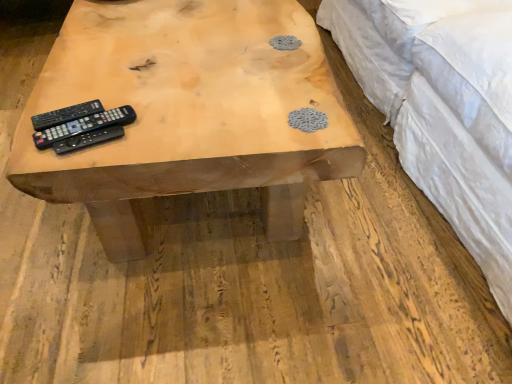
Question: Is black matte remote control at left, which is the first remote control from back to front, spatially inside black matte remote control at center, which appears as the first remote control when viewed from the front, or outside of it?

Choices:
 (A) outside
 (B) inside

Answer: (A)

Question: Considering the positions of black matte remote control at left, which is the first remote control from back to front, and black matte remote control at center, which appears as the first remote control when viewed from the front, in the image, is black matte remote control at left, which is the first remote control from back to front, bigger or smaller than black matte remote control at center, which appears as the first remote control when viewed from the front,?

Choices:
 (A) small
 (B) big

Answer: (A)

Question: Which is farther from the white quilted fabric at upper right?

Choices:
 (A) black matte remote control at left, which is the first remote control from back to front
 (B) black matte remote control at center, which is the third remote control from back to front
 (C) black plastic remote at left, which ranks as the 2th remote control in back-to-front order
 (D) natural wood table at center

Answer: (A)

Question: Estimate the real-world distances between objects in this image. Which object is closer to the white quilted fabric at upper right?

Choices:
 (A) black matte remote control at left, which is the first remote control from back to front
 (B) black matte remote control at center, which is the third remote control from back to front
 (C) black plastic remote at left, which ranks as the 2th remote control in back-to-front order
 (D) natural wood table at center

Answer: (D)